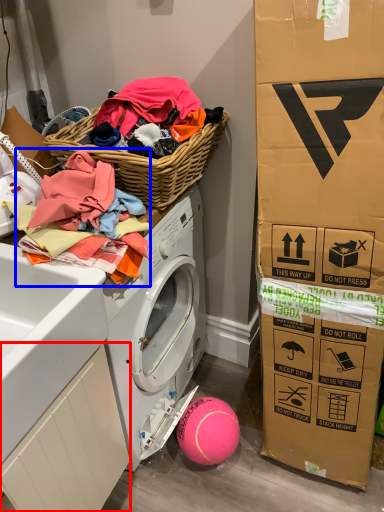
Question: Which object is closer to the camera taking this photo, drawer (highlighted by a red box) or clothing (highlighted by a blue box)?

Choices:
 (A) drawer
 (B) clothing

Answer: (A)